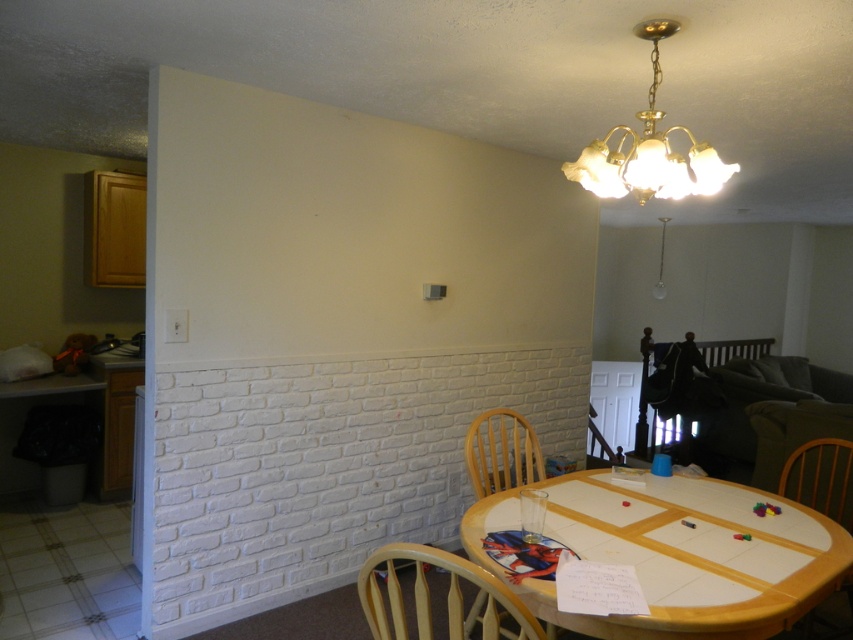
Who is lower down, gold glass chandelier at upper center or wooden chair at lower right?

wooden chair at lower right is below.

Is gold glass chandelier at upper center closer to camera compared to wooden chair at lower right?

Yes.

The height and width of the screenshot is (640, 853). In order to click on gold glass chandelier at upper center in this screenshot , I will do [x=648, y=148].

Can you confirm if light wood chair at lower center is positioned to the right of wooden chair at center?

In fact, light wood chair at lower center is to the left of wooden chair at center.

Is point (451, 592) closer to viewer compared to point (526, 432)?

That is True.

Which is in front, point (403, 604) or point (502, 432)?

Point (403, 604) is in front.

Find the location of a particular element. light wood chair at lower center is located at coordinates (445, 598).

Consider the image. Is light wood chair at lower center smaller than gold glass chandelier at upper center?

Incorrect, light wood chair at lower center is not smaller in size than gold glass chandelier at upper center.

Can you confirm if light wood chair at lower center is positioned above gold glass chandelier at upper center?

Actually, light wood chair at lower center is below gold glass chandelier at upper center.

Is point (383, 632) closer to camera compared to point (633, 193)?

Yes.

At what (x,y) coordinates should I click in order to perform the action: click on light wood chair at lower center. Please return your answer as a coordinate pair (x, y). Image resolution: width=853 pixels, height=640 pixels. Looking at the image, I should click on (445, 598).